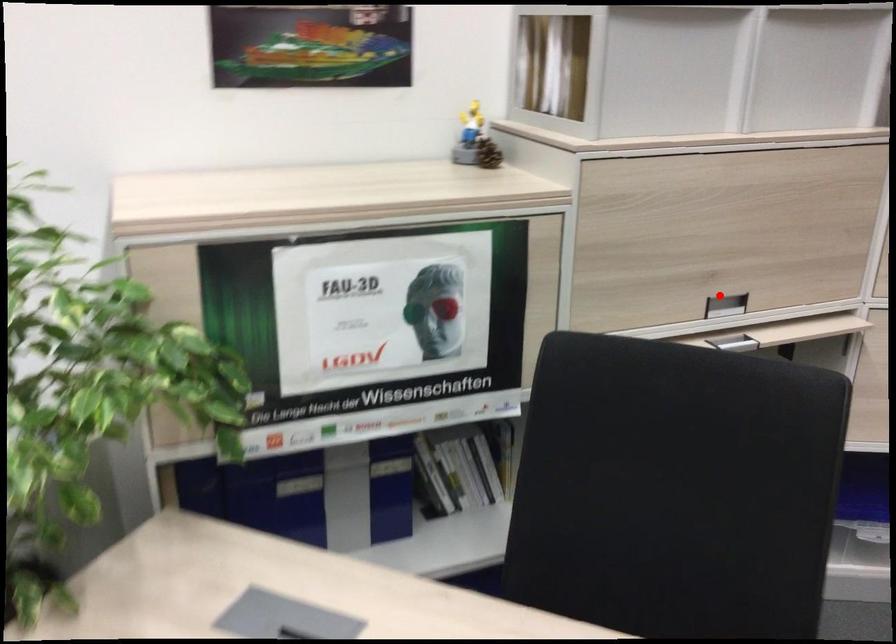
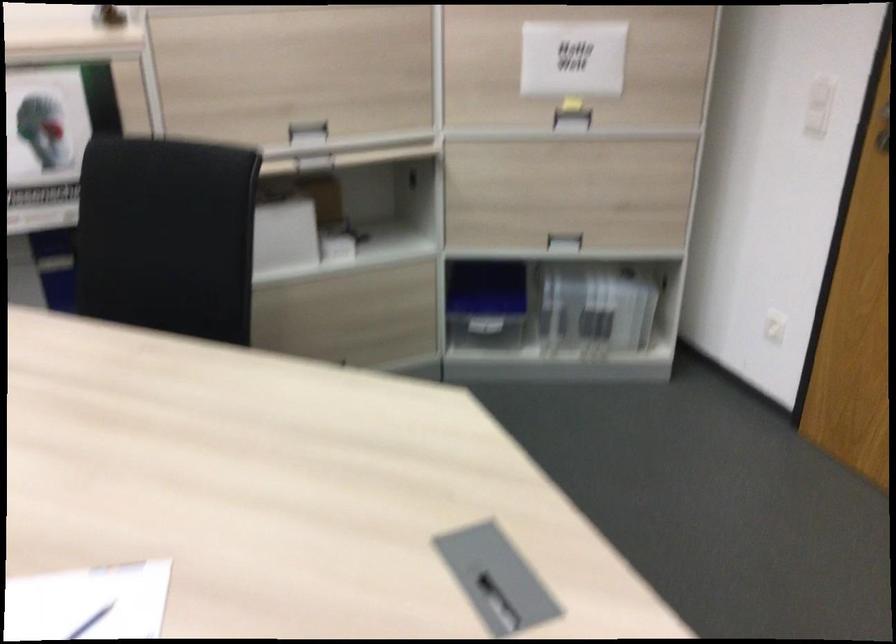
Question: I am providing you with two images of the same scene from different viewpoints. In image1, a red point is highlighted. Considering the same 3D point in image2, which of the following is correct?

Choices:
 (A) It is closer
 (B) It is farther

Answer: (B)